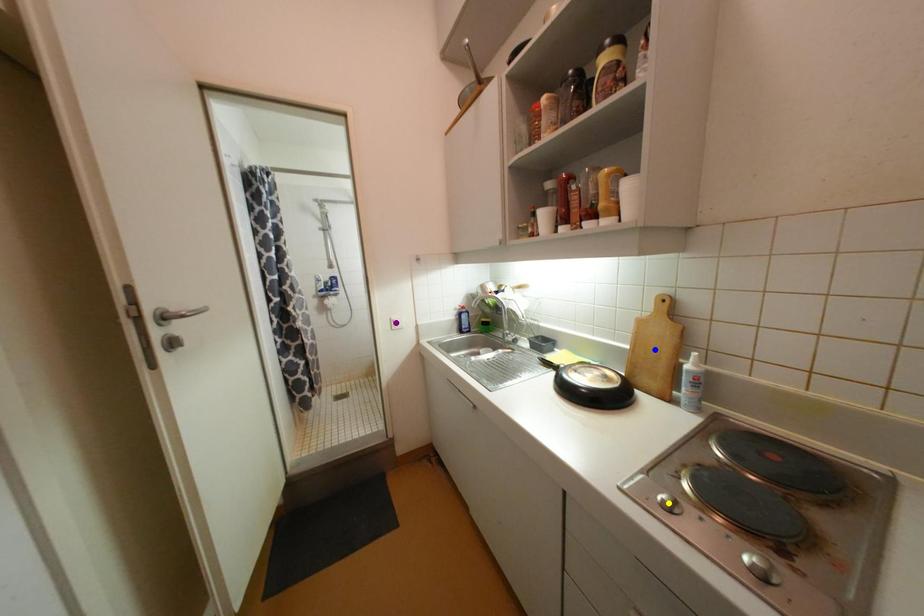
Order these from nearest to farthest:
blue point, purple point, yellow point

1. yellow point
2. blue point
3. purple point